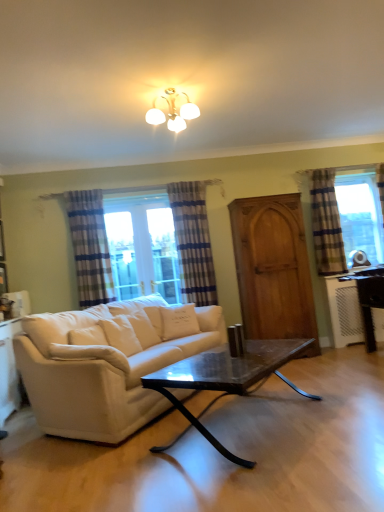
Question: Considering the relative sizes of white glossy light fixture at upper center and blue striped curtain at right, acting as the 1th curtain starting from the right, in the image provided, is white glossy light fixture at upper center smaller than blue striped curtain at right, acting as the 1th curtain starting from the right,?

Choices:
 (A) yes
 (B) no

Answer: (A)

Question: Is the position of white glossy light fixture at upper center more distant than that of blue striped curtain at right, acting as the 1th curtain starting from the right?

Choices:
 (A) yes
 (B) no

Answer: (B)

Question: Is white glossy light fixture at upper center aimed at blue striped curtain at right, acting as the 1th curtain starting from the right?

Choices:
 (A) yes
 (B) no

Answer: (B)

Question: From the image's perspective, would you say white glossy light fixture at upper center is positioned over blue striped curtain at right, acting as the 1th curtain starting from the right?

Choices:
 (A) yes
 (B) no

Answer: (A)

Question: From the image's perspective, is white glossy light fixture at upper center below blue striped curtain at right, which appears as the third curtain when viewed from the left?

Choices:
 (A) yes
 (B) no

Answer: (B)

Question: Is white glossy cabinet at lower left in front of or behind white glossy light fixture at upper center in the image?

Choices:
 (A) behind
 (B) front

Answer: (A)

Question: Considering the positions of white glossy cabinet at lower left and white glossy light fixture at upper center in the image, is white glossy cabinet at lower left wider or thinner than white glossy light fixture at upper center?

Choices:
 (A) thin
 (B) wide

Answer: (A)

Question: In terms of size, does white glossy cabinet at lower left appear bigger or smaller than white glossy light fixture at upper center?

Choices:
 (A) big
 (B) small

Answer: (B)

Question: Is white glossy cabinet at lower left situated inside white glossy light fixture at upper center or outside?

Choices:
 (A) inside
 (B) outside

Answer: (B)

Question: Is blue striped curtain at center, which ranks as the 2th curtain in right-to-left order, to the left or to the right of white fabric pillow at center, which is the 1th pillow from back to front, in the image?

Choices:
 (A) right
 (B) left

Answer: (A)

Question: From the image's perspective, is blue striped curtain at center, the second curtain from the left, positioned above or below white fabric pillow at center, positioned as the 2th pillow in left-to-right order?

Choices:
 (A) below
 (B) above

Answer: (B)

Question: From a real-world perspective, relative to white fabric pillow at center, the 2th pillow viewed from the front, is blue striped curtain at center, the second curtain from the left, vertically above or below?

Choices:
 (A) above
 (B) below

Answer: (A)

Question: Relative to white fabric pillow at center, which is the 1th pillow from back to front, is blue striped curtain at center, which ranks as the 2th curtain in right-to-left order, in front or behind?

Choices:
 (A) behind
 (B) front

Answer: (A)

Question: Visually, is wooden screen door at center positioned to the left or to the right of blue striped curtain at center, the second curtain from the left?

Choices:
 (A) left
 (B) right

Answer: (B)

Question: Based on their sizes in the image, would you say wooden screen door at center is bigger or smaller than blue striped curtain at center, the second curtain from the left?

Choices:
 (A) small
 (B) big

Answer: (B)